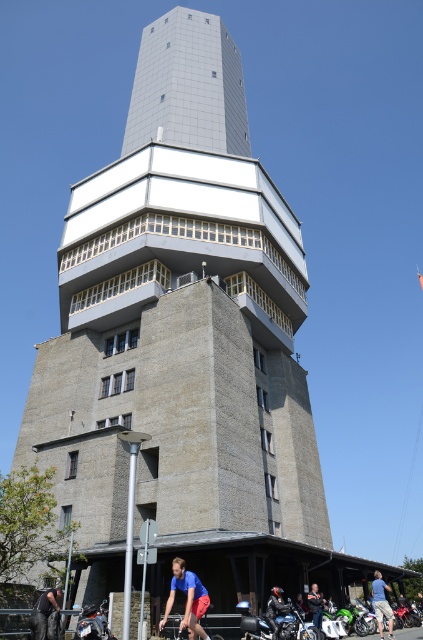
Between gray concrete building at center and shiny black motorcycle at lower center, which one appears on the right side from the viewer's perspective?

shiny black motorcycle at lower center

This screenshot has width=423, height=640. Describe the element at coordinates (181, 336) in the screenshot. I see `gray concrete building at center` at that location.

The width and height of the screenshot is (423, 640). Find the location of `gray concrete building at center`. gray concrete building at center is located at coordinates (181, 336).

Is gray concrete building at center bigger than dark gray jeans at lower left?

Indeed, gray concrete building at center has a larger size compared to dark gray jeans at lower left.

Is point (82, 225) closer to camera compared to point (54, 600)?

That is False.

At what (x,y) coordinates should I click in order to perform the action: click on gray concrete building at center. Please return your answer as a coordinate pair (x, y). Image resolution: width=423 pixels, height=640 pixels. Looking at the image, I should click on (181, 336).

Identify the location of gray concrete building at center. (181, 336).

Can you confirm if gray concrete building at center is taller than leather jacket at lower center?

Yes.

Which is in front, point (129, 164) or point (316, 611)?

Point (316, 611) is more forward.

This screenshot has height=640, width=423. What are the coordinates of `gray concrete building at center` in the screenshot? It's located at (181, 336).